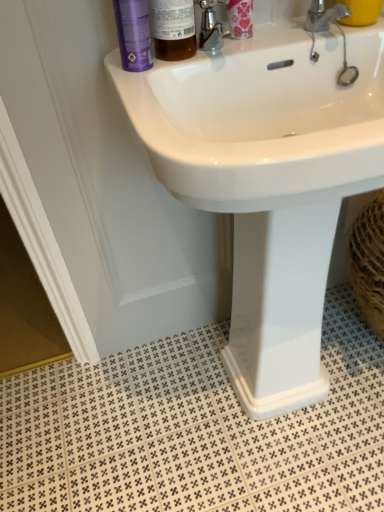
Question: From the image's perspective, is yellow matte cup at upper right above or below purple matte bottle at upper left?

Choices:
 (A) below
 (B) above

Answer: (B)

Question: In the image, is yellow matte cup at upper right positioned in front of or behind purple matte bottle at upper left?

Choices:
 (A) behind
 (B) front

Answer: (A)

Question: Estimate the real-world distances between objects in this image. Which object is farther from the white textured tile at lower center?

Choices:
 (A) translucent amber bottle at upper center
 (B) floral-patterned plastic container at upper center
 (C) purple matte bottle at upper left
 (D) white glossy sink at upper center
 (E) silver metallic faucet at upper right

Answer: (E)

Question: Estimate the real-world distances between objects in this image. Which object is farther from the white glossy sink at upper center?

Choices:
 (A) purple matte bottle at upper left
 (B) yellow matte cup at upper right
 (C) white textured tile at lower center
 (D) floral-patterned plastic container at upper center
 (E) translucent amber bottle at upper center

Answer: (B)